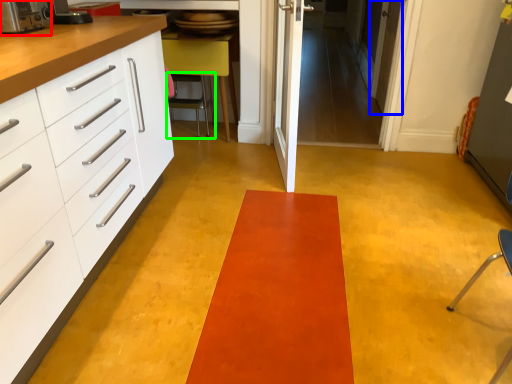
Question: Considering the real-world distances, which object is closest to appliance (highlighted by a red box)? door (highlighted by a blue box) or chair (highlighted by a green box).

Choices:
 (A) door
 (B) chair

Answer: (B)